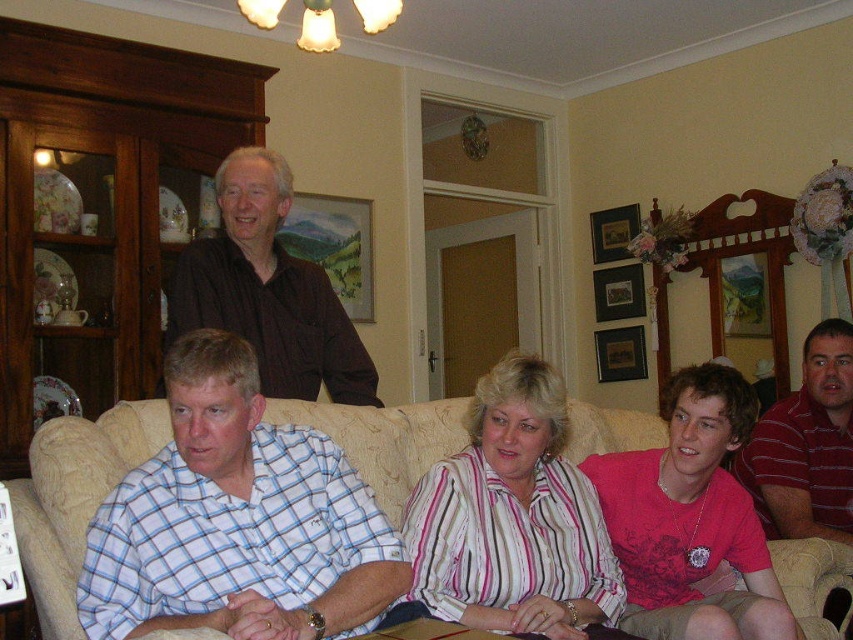
You are standing in the living room and want to reach a point that is 1.85 meters away from you. Is the point at coordinates point (393, 536) within that distance?

The distance of point (393, 536) from viewer is 1.85 meters, so yes, the point at coordinates point (393, 536) is exactly 1.85 meters away from you.

You are standing in the living room and want to take a photo of the point at coordinates point (57, 547). Based on the description, is this point within the camera frame?

The point (57, 547) is 5.92 feet away from the camera, so it is likely within the camera frame if the camera has a standard field of view and the focus is set appropriately.

What are the coordinates of the white checkered shirt at lower left?

The coordinates of the white checkered shirt at lower left are at point (236, 520).